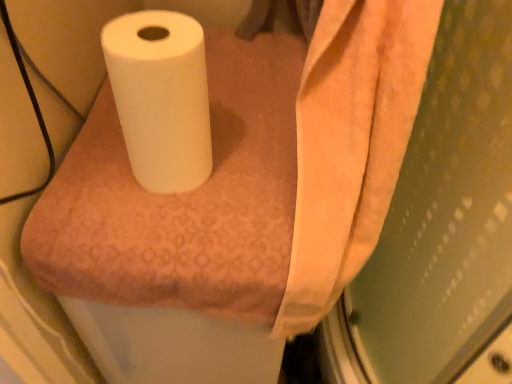
Where is `free space to the back side of white matte toilet paper at center`? The height and width of the screenshot is (384, 512). free space to the back side of white matte toilet paper at center is located at coordinates (230, 102).